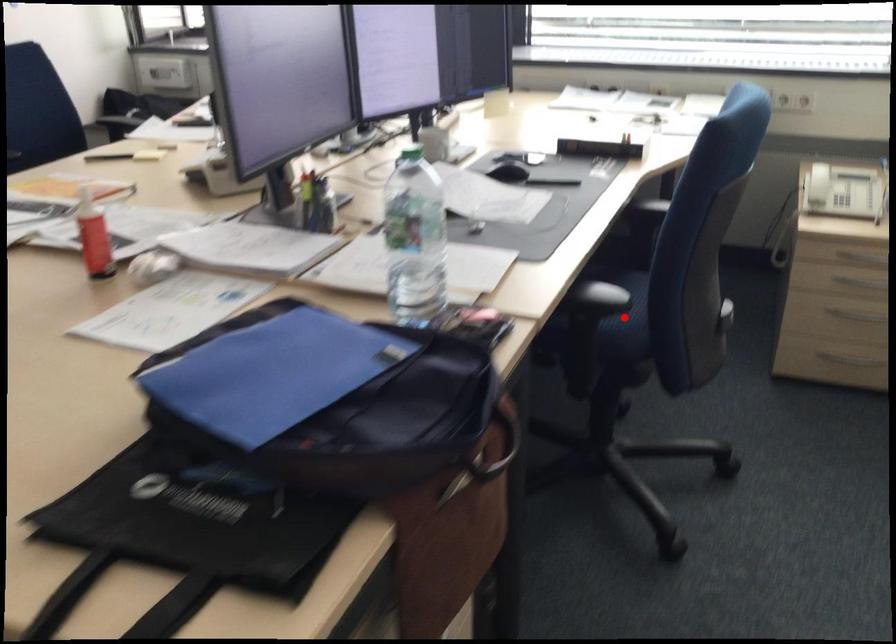
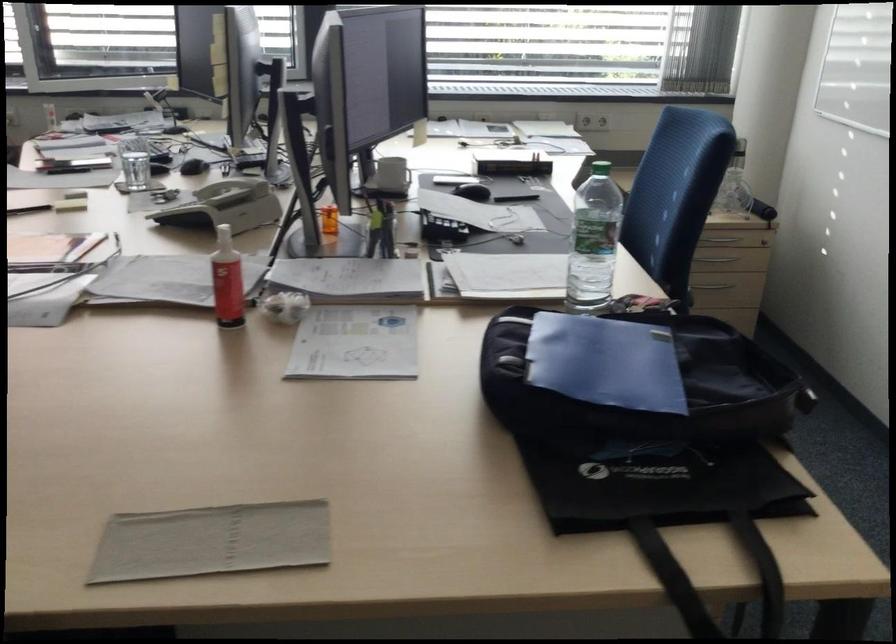
Question: I am providing you with two images of the same scene from different viewpoints. A red point is marked on the first image. At the location where the point appears in image 1, is it still visible in image 2?

Choices:
 (A) Yes
 (B) No

Answer: (B)